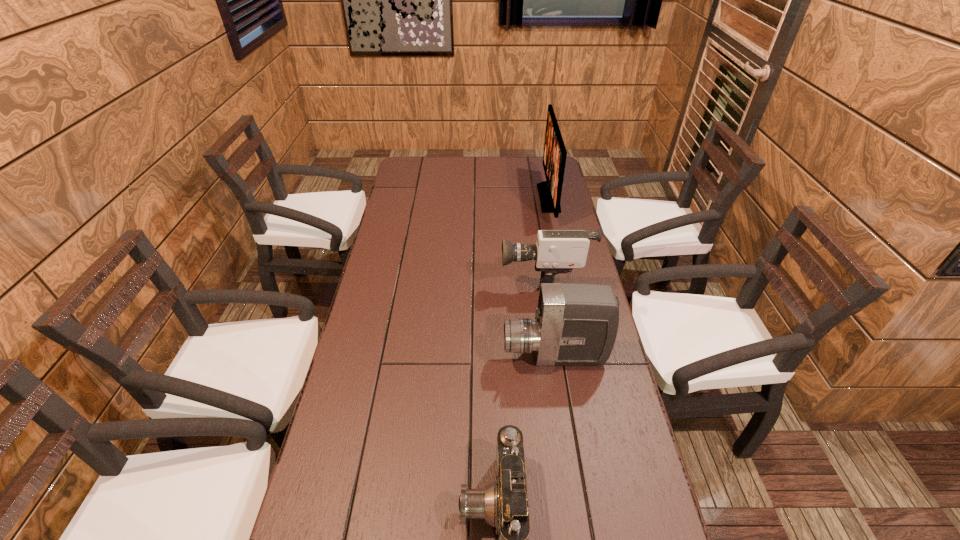
The width and height of the screenshot is (960, 540). Find the location of `the tallest object`. the tallest object is located at coordinates (554, 157).

You are a GUI agent. You are given a task and a screenshot of the screen. Output one action in this format:
    pyautogui.click(x=<x>, y=<y>)
    Task: Click on the farthest object
    This screenshot has width=960, height=540.
    Given the screenshot: What is the action you would take?
    pyautogui.click(x=554, y=157)

The width and height of the screenshot is (960, 540). What are the coordinates of `the second nearest camcorder` in the screenshot? It's located at (575, 324).

In order to click on the third nearest object in this screenshot , I will do `click(557, 251)`.

Identify the location of vacant position located 0.350m on the front-facing side of the tallest object. This screenshot has height=540, width=960. (455, 198).

The height and width of the screenshot is (540, 960). I want to click on vacant area located 0.140m on the front-facing side of the tallest object, so click(x=505, y=198).

Where is `free region located on the front-facing side of the tallest object`? free region located on the front-facing side of the tallest object is located at coordinates (472, 198).

Identify the location of blank space located 0.330m at the front of the second farthest camcorder, highlighting the lens. (385, 357).

Identify the location of free space located 0.130m at the front of the second farthest camcorder, highlighting the lens. The height and width of the screenshot is (540, 960). (457, 357).

Where is `vacant space located 0.280m at the front of the second farthest camcorder, highlighting the lens`? vacant space located 0.280m at the front of the second farthest camcorder, highlighting the lens is located at coordinates (403, 357).